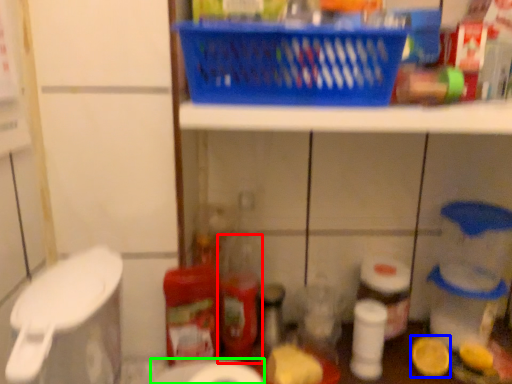
Question: Which object is the farthest from bottle (highlighted by a red box)? Choose among these: lemon (highlighted by a blue box) or toilet paper (highlighted by a green box).

Choices:
 (A) lemon
 (B) toilet paper

Answer: (A)